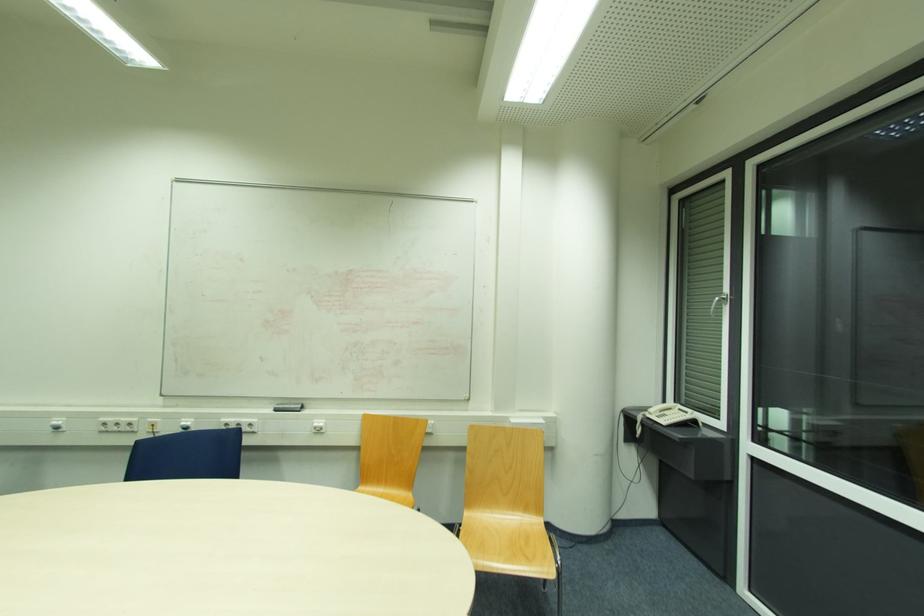
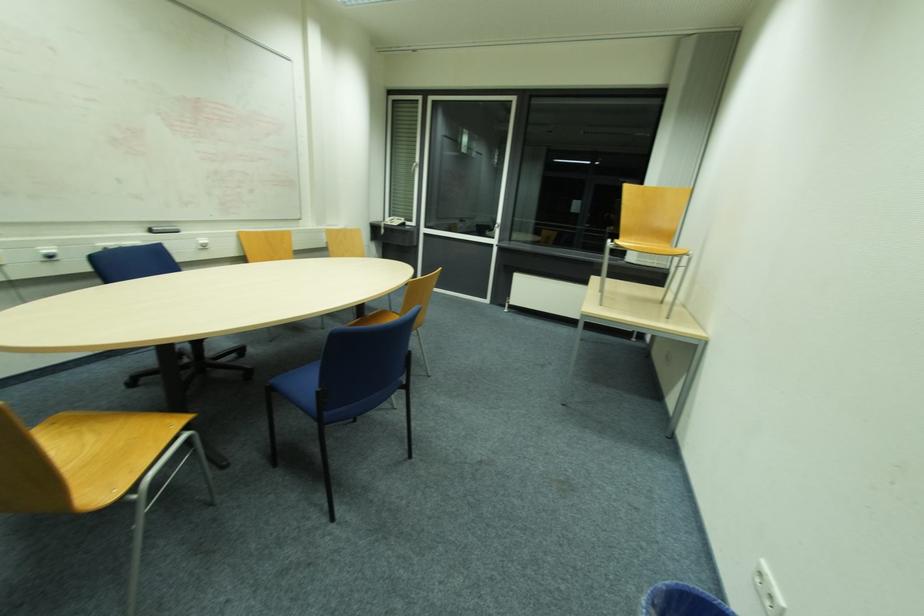
Find the pixel in the second image that matches (665,422) in the first image.

(397, 225)